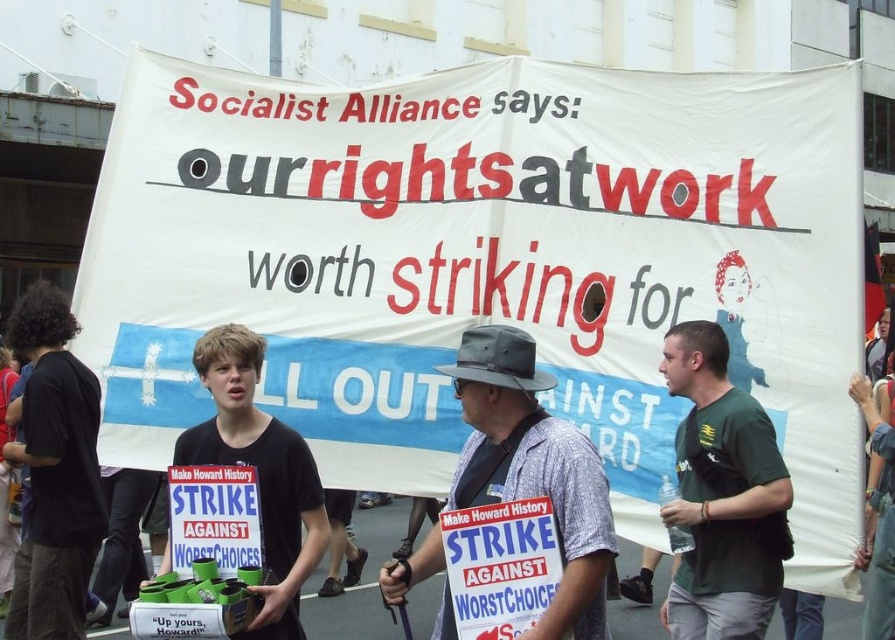
What do you see at coordinates (534, 472) in the screenshot?
I see `plaid fabric shirt at center` at bounding box center [534, 472].

Between plaid fabric shirt at center and green fabric shirt at center, which one appears on the left side from the viewer's perspective?

plaid fabric shirt at center is more to the left.

I want to click on plaid fabric shirt at center, so click(x=534, y=472).

This screenshot has width=895, height=640. In order to click on plaid fabric shirt at center in this screenshot , I will do point(534,472).

Is plaid fabric shirt at center behind black matte t-shirt at center?

That is False.

Find the location of a particular element. plaid fabric shirt at center is located at coordinates (534, 472).

Between point (534, 458) and point (325, 544), which one is positioned behind?

Point (325, 544)

This screenshot has height=640, width=895. Find the location of `plaid fabric shirt at center`. plaid fabric shirt at center is located at coordinates (534, 472).

Can you confirm if plaid fabric shirt at center is bigger than black cotton t-shirt at left?

Incorrect, plaid fabric shirt at center is not larger than black cotton t-shirt at left.

Is plaid fabric shirt at center above black cotton t-shirt at left?

Actually, plaid fabric shirt at center is below black cotton t-shirt at left.

What do you see at coordinates (534, 472) in the screenshot? The width and height of the screenshot is (895, 640). I see `plaid fabric shirt at center` at bounding box center [534, 472].

Find the location of a particular element. The height and width of the screenshot is (640, 895). plaid fabric shirt at center is located at coordinates (534, 472).